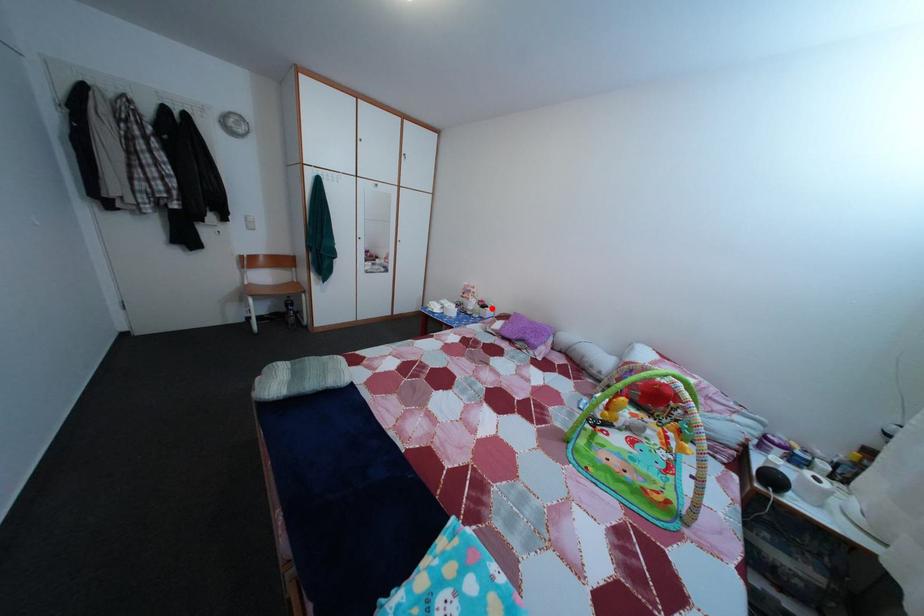
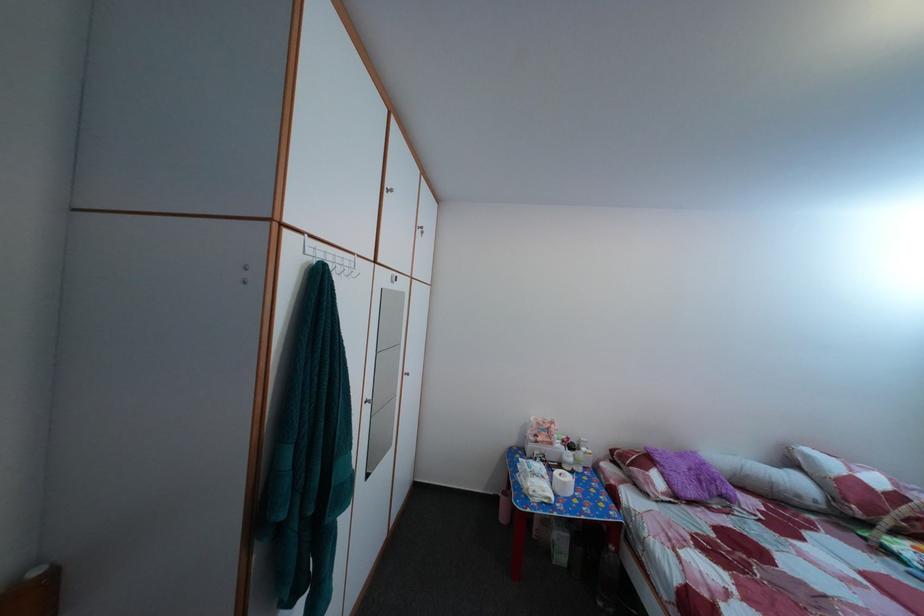
Question: I am providing you with two images of the same scene from different viewpoints. Given a red point in image1, look at the same physical point in image2. Is it:

Choices:
 (A) Closer to the viewpoint
 (B) Farther from the viewpoint

Answer: (B)